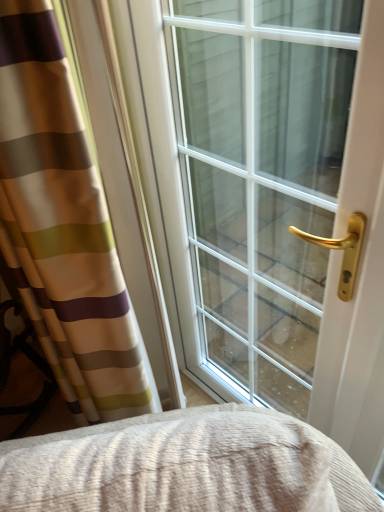
Identify the location of clear glass window at center. This screenshot has height=512, width=384. (249, 184).

What do you see at coordinates (249, 184) in the screenshot? I see `clear glass window at center` at bounding box center [249, 184].

This screenshot has width=384, height=512. Describe the element at coordinates (63, 226) in the screenshot. I see `striped fabric curtain at left` at that location.

The image size is (384, 512). I want to click on striped fabric curtain at left, so click(63, 226).

Locate an element on the screen. The width and height of the screenshot is (384, 512). clear glass window at center is located at coordinates (249, 184).

Does clear glass window at center appear on the left side of striped fabric curtain at left?

In fact, clear glass window at center is to the right of striped fabric curtain at left.

Considering the positions of objects clear glass window at center and striped fabric curtain at left in the image provided, who is in front, clear glass window at center or striped fabric curtain at left?

striped fabric curtain at left is closer to the camera.

Between point (277, 160) and point (1, 124), which one is positioned behind?

The point (277, 160) is farther from the camera.

From the image's perspective, would you say clear glass window at center is positioned over striped fabric curtain at left?

Yes.

From a real-world perspective, is clear glass window at center positioned above or below striped fabric curtain at left?

clear glass window at center is situated lower than striped fabric curtain at left in the real world.

Consider the image. Can you confirm if clear glass window at center is wider than striped fabric curtain at left?

Yes, clear glass window at center is wider than striped fabric curtain at left.

Which of these two, clear glass window at center or striped fabric curtain at left, stands shorter?

striped fabric curtain at left.

Considering the sizes of objects clear glass window at center and striped fabric curtain at left in the image provided, who is bigger, clear glass window at center or striped fabric curtain at left?

With larger size is clear glass window at center.

Based on the photo, is clear glass window at center situated inside striped fabric curtain at left or outside?

clear glass window at center is located beyond the bounds of striped fabric curtain at left.

Are clear glass window at center and striped fabric curtain at left located far from each other?

Actually, clear glass window at center and striped fabric curtain at left are a little close together.

Is clear glass window at center positioned with its back to striped fabric curtain at left?

No, clear glass window at center is not facing the opposite direction of striped fabric curtain at left.

How different are the orientations of clear glass window at center and striped fabric curtain at left in degrees?

They differ by 0.998 degrees in their facing directions.

What are the coordinates of `window above the striped fabric curtain at left (from the image's perspective)` in the screenshot? It's located at (249, 184).

Is striped fabric curtain at left to the left of clear glass window at center from the viewer's perspective?

Correct, you'll find striped fabric curtain at left to the left of clear glass window at center.

Relative to clear glass window at center, is striped fabric curtain at left in front or behind?

Visually, striped fabric curtain at left is located in front of clear glass window at center.

Considering the positions of points (127, 408) and (298, 367), is point (127, 408) closer to camera compared to point (298, 367)?

Yes.

From the image's perspective, which one is positioned higher, striped fabric curtain at left or clear glass window at center?

clear glass window at center is shown above in the image.

From a real-world perspective, relative to clear glass window at center, is striped fabric curtain at left vertically above or below?

In terms of real-world spatial position, striped fabric curtain at left is above clear glass window at center.

Considering the relative sizes of striped fabric curtain at left and clear glass window at center in the image provided, is striped fabric curtain at left thinner than clear glass window at center?

Yes, striped fabric curtain at left is thinner than clear glass window at center.

Between striped fabric curtain at left and clear glass window at center, which one has less height?

striped fabric curtain at left.

Which of these two, striped fabric curtain at left or clear glass window at center, is smaller?

striped fabric curtain at left is smaller.

Is striped fabric curtain at left surrounding clear glass window at center?

Actually, clear glass window at center is outside striped fabric curtain at left.

Is striped fabric curtain at left in contact with clear glass window at center?

They are not placed beside each other.

Is clear glass window at center at the back of striped fabric curtain at left?

Yes, clear glass window at center is at the back of striped fabric curtain at left.

What's the angular difference between striped fabric curtain at left and clear glass window at center's facing directions?

striped fabric curtain at left and clear glass window at center are facing 0.998 degrees away from each other.

This screenshot has height=512, width=384. Find the location of `curtain that appears above the clear glass window at center (from a real-world perspective)`. curtain that appears above the clear glass window at center (from a real-world perspective) is located at coordinates (63, 226).

In the image, there is a striped fabric curtain at left. Find the location of `window above it (from the image's perspective)`. window above it (from the image's perspective) is located at coordinates (249, 184).

What are the coordinates of `curtain in front of the clear glass window at center` in the screenshot? It's located at (63, 226).